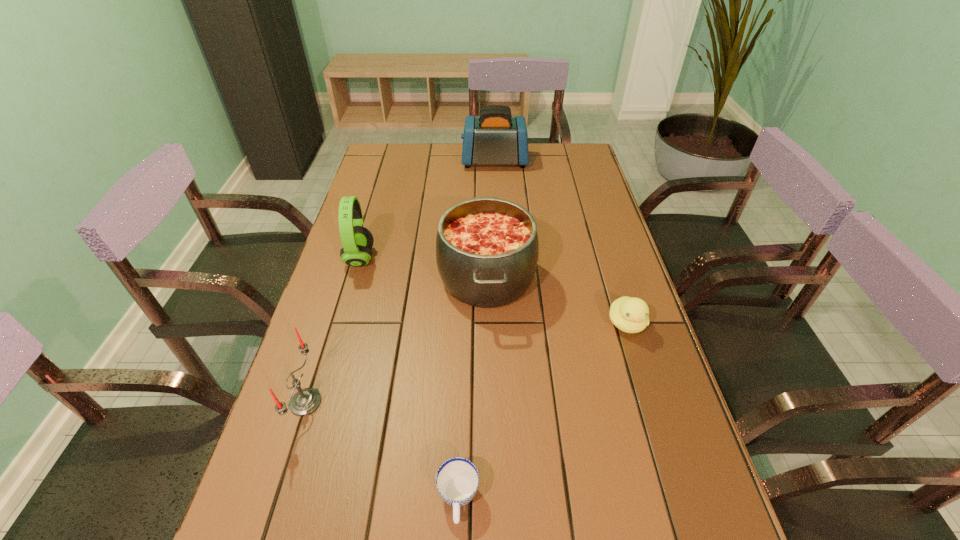
Image resolution: width=960 pixels, height=540 pixels. I want to click on object that is the closest one to the candle, so click(487, 249).

You are a GUI agent. You are given a task and a screenshot of the screen. Output one action in this format:
    pyautogui.click(x=<x>, y=<y>)
    Task: Click on the second closest object to the cup
    
    Given the screenshot: What is the action you would take?
    pyautogui.click(x=487, y=249)

This screenshot has width=960, height=540. What are the coordinates of `vacant space that satisfies the following two spatial constraints: 1. on the front-facing side of the farthest object; 2. on the front side of the casserole` in the screenshot? It's located at (500, 278).